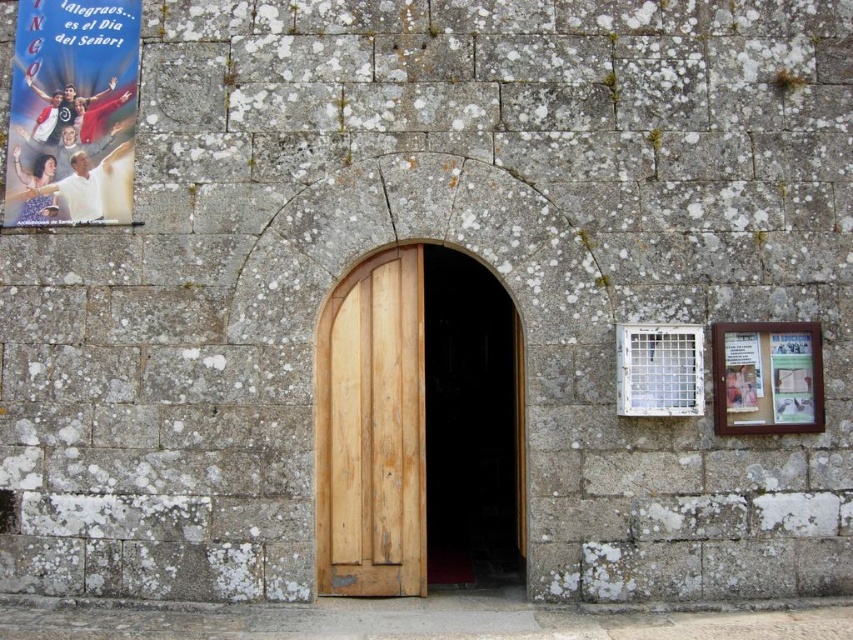
Who is shorter, light brown wood door at center or matte paper poster at upper left?

matte paper poster at upper left

Does light brown wood door at center appear on the right side of matte paper poster at upper left?

Indeed, light brown wood door at center is positioned on the right side of matte paper poster at upper left.

I want to click on light brown wood door at center, so click(x=370, y=429).

Does point (22, 16) lie behind point (732, 413)?

Yes, it is behind point (732, 413).

What are the coordinates of `matte paper poster at upper left` in the screenshot? It's located at (73, 112).

Between point (372, 464) and point (804, 403), which one is positioned in front?

Point (804, 403)

Does point (421, 282) lie in front of point (740, 364)?

No, (421, 282) is further to viewer.

At what (x,y) coordinates should I click in order to perform the action: click on light brown wood door at center. Please return your answer as a coordinate pair (x, y). Looking at the image, I should click on (370, 429).